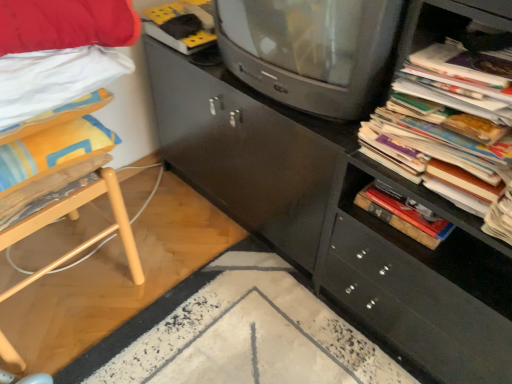
Question: Is point (224, 13) positioned closer to the camera than point (15, 289)?

Choices:
 (A) farther
 (B) closer

Answer: (B)

Question: Relative to light wood chair at left, is matte gray television at center in front or behind?

Choices:
 (A) front
 (B) behind

Answer: (B)

Question: Estimate the real-world distances between objects in this image. Which object is closer to the light wood chair at left?

Choices:
 (A) matte gray television at center
 (B) matte black cabinet at center
 (C) stacked paper at right

Answer: (A)

Question: Estimate the real-world distances between objects in this image. Which object is farther from the matte gray television at center?

Choices:
 (A) stacked paper at right
 (B) matte black cabinet at center
 (C) light wood chair at left

Answer: (C)